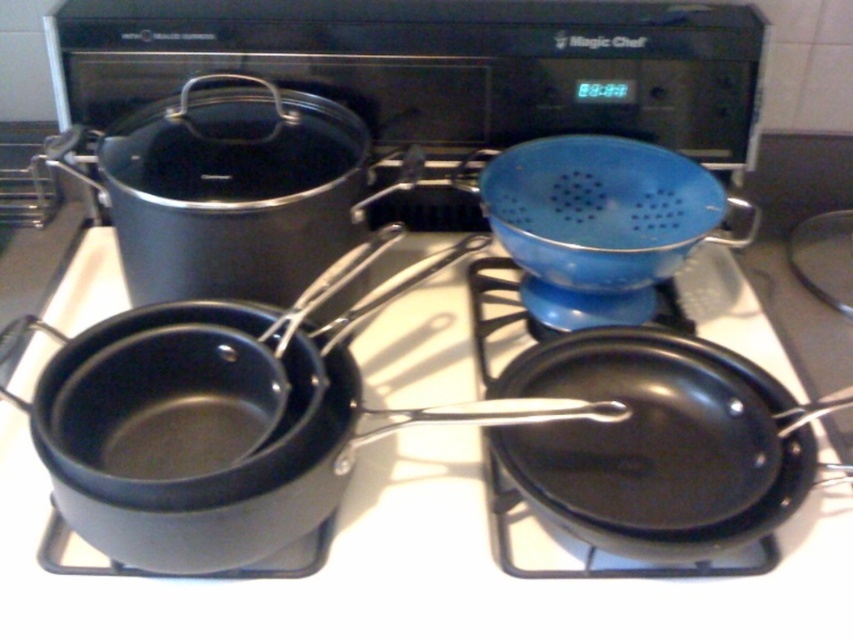
Question: Where is black non-stick frying pan at lower right located in relation to black matte frying pan at lower right in the image?

Choices:
 (A) left
 (B) right

Answer: (A)

Question: Which of the following is the farthest from the observer?

Choices:
 (A) black non-stick frying pan at lower right
 (B) black matte frying pan at lower right

Answer: (B)

Question: Does black non-stick frying pan at lower right appear under black matte frying pan at lower right?

Choices:
 (A) yes
 (B) no

Answer: (B)

Question: Which object is farther from the camera taking this photo?

Choices:
 (A) black matte frying pan at lower right
 (B) black non-stick frying pan at lower right

Answer: (A)

Question: Does black non-stick frying pan at lower right have a lesser width compared to black matte frying pan at lower right?

Choices:
 (A) no
 (B) yes

Answer: (A)